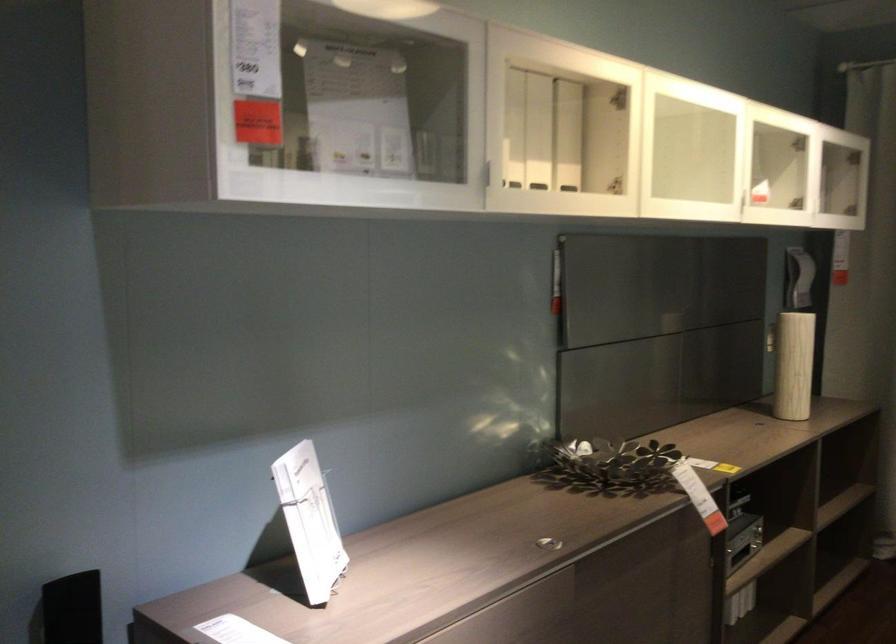
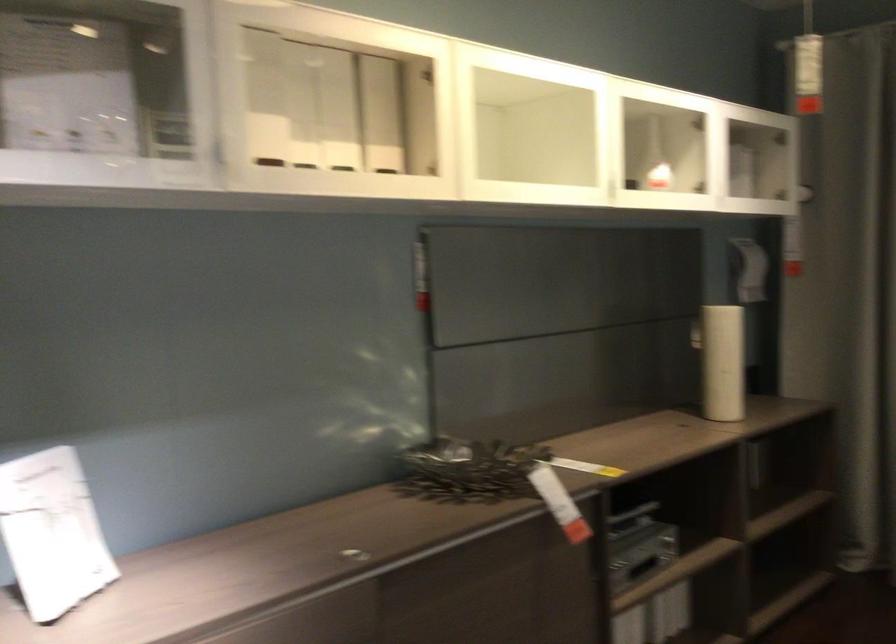
Question: The camera is either moving clockwise (left) or counter-clockwise (right) around the object. The first image is from the beginning of the video and the second image is from the end. Is the camera moving left or right when shooting the video?

Choices:
 (A) Left
 (B) Right

Answer: (B)